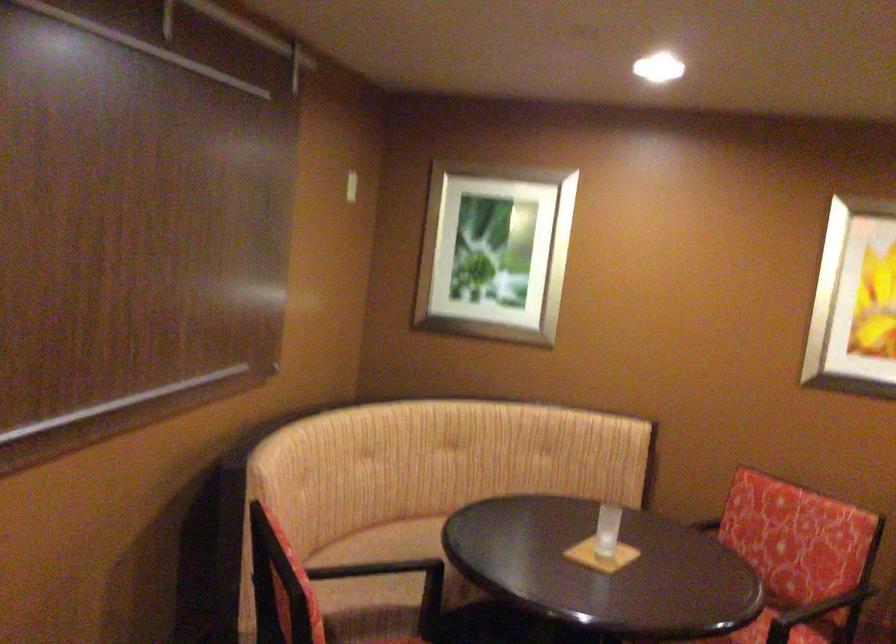
Describe the element at coordinates (385, 567) in the screenshot. I see `the sofa sitting surface` at that location.